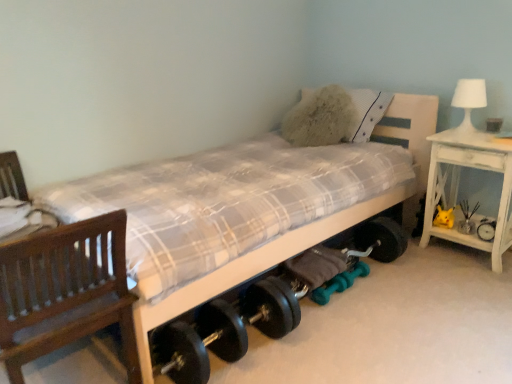
The height and width of the screenshot is (384, 512). Find the location of `free location to the right of teal rubber dumbbell at lower center, marked as the first dumbbell in a left-to-right arrangement`. free location to the right of teal rubber dumbbell at lower center, marked as the first dumbbell in a left-to-right arrangement is located at coordinates (365, 300).